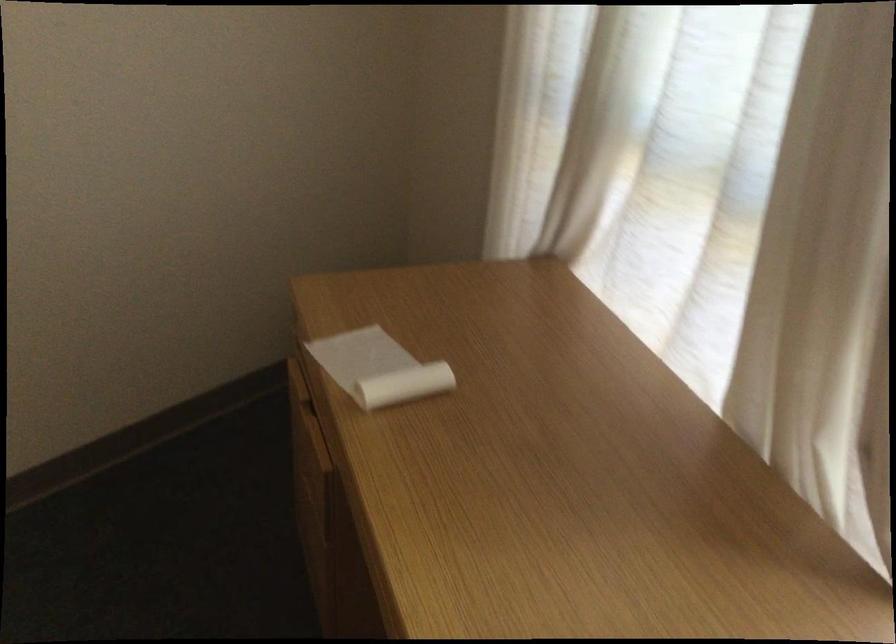
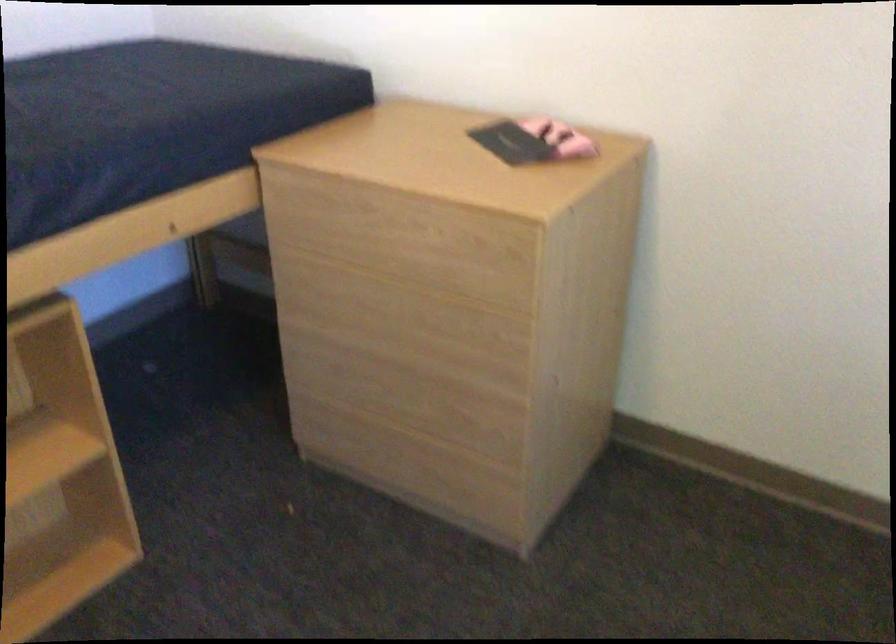
How did the camera likely rotate?

The rotation direction of the camera is left-down.